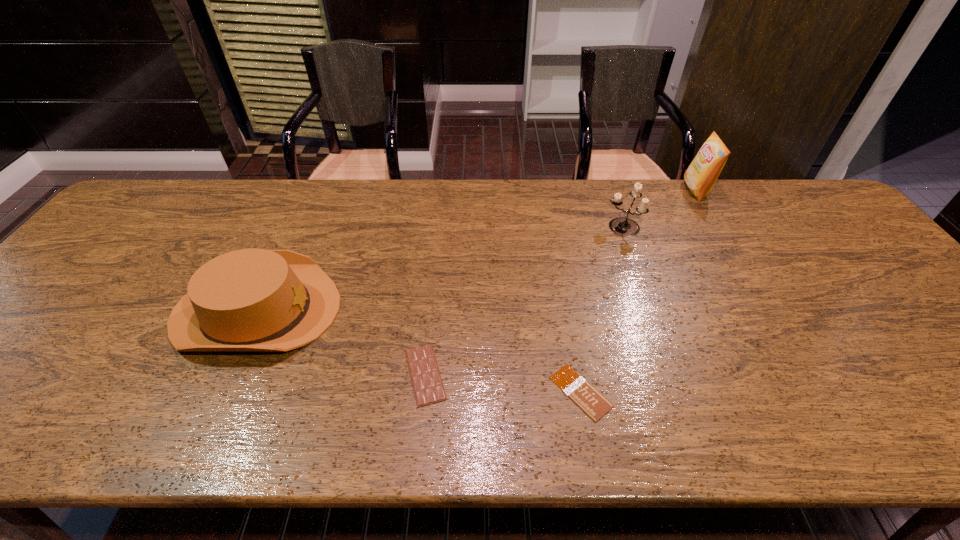
The height and width of the screenshot is (540, 960). I want to click on free space at the near edge of the desktop, so point(414,433).

What are the coordinates of `vacant space at the left edge of the desktop` in the screenshot? It's located at (60, 347).

Where is `blank area at the right edge`? The image size is (960, 540). blank area at the right edge is located at coordinates (805, 229).

I want to click on free space at the far right corner of the desktop, so click(815, 215).

At what (x,y) coordinates should I click in order to perform the action: click on free spot between the shortest object and the fourth object from left to right. Please return your answer as a coordinate pair (x, y). This screenshot has width=960, height=540. Looking at the image, I should click on (601, 309).

I want to click on free spot between the second farthest object and the leftmost object, so click(440, 268).

Find the location of a particular element. This screenshot has height=540, width=960. vacant space that's between the taller chocolate bar and the right chocolate bar is located at coordinates (503, 383).

I want to click on free area in between the left chocolate bar and the leftmost object, so click(341, 342).

You are a GUI agent. You are given a task and a screenshot of the screen. Output one action in this format:
    pyautogui.click(x=<x>, y=<y>)
    Task: Click on the unoccupied position between the tallest object and the taller chocolate bar
    Image resolution: width=960 pixels, height=540 pixels.
    Given the screenshot: What is the action you would take?
    pyautogui.click(x=561, y=282)

At what (x,y) coordinates should I click in order to perform the action: click on vacant space in between the crisp (potato chip) and the shortest object. Please return your answer as a coordinate pair (x, y). This screenshot has height=540, width=960. Looking at the image, I should click on (638, 291).